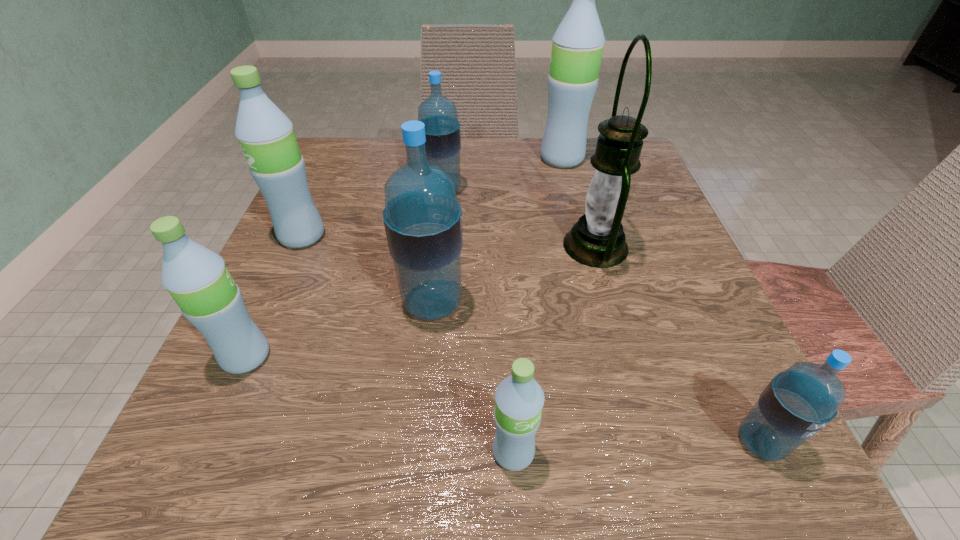
The height and width of the screenshot is (540, 960). In order to click on free spot between the second nearest green water bottle and the farthest blue water bottle in this screenshot , I will do `click(345, 273)`.

Locate which object is the fifth closest to the second smallest blue water bottle. Please provide its 2D coordinates. Your answer should be formatted as a tuple, i.e. [(x, y)], where the tuple contains the x and y coordinates of a point satisfying the conditions above.

[(197, 278)]

Locate which object is the third closest to the fourth object from right to left. Please provide its 2D coordinates. Your answer should be formatted as a tuple, i.e. [(x, y)], where the tuple contains the x and y coordinates of a point satisfying the conditions above.

[(597, 240)]

Where is `water bottle identified as the sixth closest to the sixth farthest object`? The width and height of the screenshot is (960, 540). water bottle identified as the sixth closest to the sixth farthest object is located at coordinates coord(578,42).

Choose which water bottle is the fourth nearest neighbor to the fifth farthest water bottle. Please provide its 2D coordinates. Your answer should be formatted as a tuple, i.e. [(x, y)], where the tuple contains the x and y coordinates of a point satisfying the conditions above.

[(442, 129)]

Select which green water bottle appears as the closest to the fifth nearest water bottle. Please provide its 2D coordinates. Your answer should be formatted as a tuple, i.e. [(x, y)], where the tuple contains the x and y coordinates of a point satisfying the conditions above.

[(197, 278)]

Point out which green water bottle is positioned as the nearest to the third water bottle from right to left. Please provide its 2D coordinates. Your answer should be formatted as a tuple, i.e. [(x, y)], where the tuple contains the x and y coordinates of a point satisfying the conditions above.

[(197, 278)]

Find the location of a particular element. blue water bottle that stands as the third closest to the farthest object is located at coordinates (799, 402).

Locate which blue water bottle ranks in proximity to the sixth nearest water bottle. Please provide its 2D coordinates. Your answer should be formatted as a tuple, i.e. [(x, y)], where the tuple contains the x and y coordinates of a point satisfying the conditions above.

[(423, 220)]

The height and width of the screenshot is (540, 960). What are the coordinates of `vacant space that satisfies the following two spatial constraints: 1. on the back side of the sixth nearest water bottle; 2. on the left side of the second biggest green water bottle` in the screenshot? It's located at (323, 190).